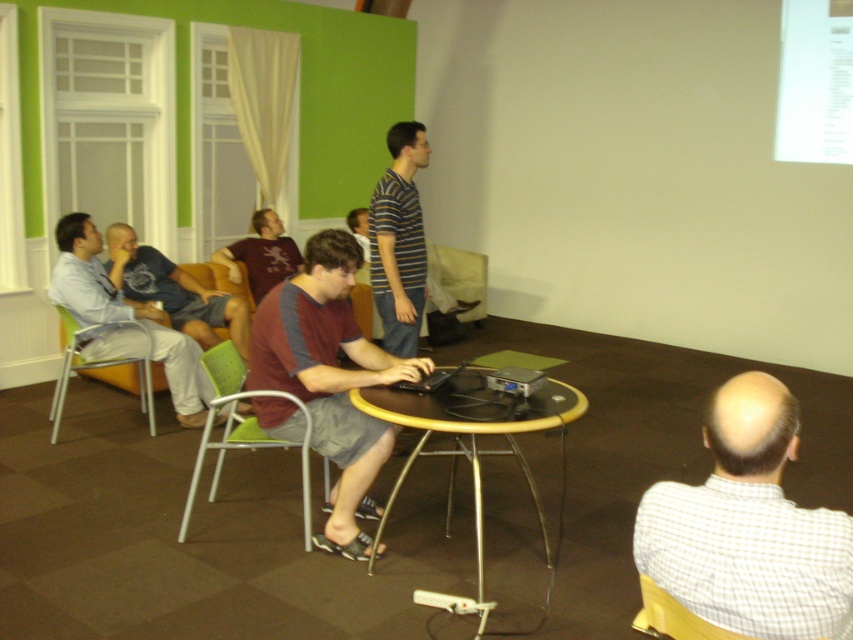
In the scene, there are two people wearing a striped cotton shirt at center and a maroon jersey at center. Which one is standing to the right of the other?

The striped cotton shirt at center is positioned on the right side of maroon jersey at center, so the striped cotton shirt at center is to the right of the maroon jersey at center.

You are standing at the entrance of the room and see the point at coordinates (100, 368). Which object is located at that point?

The point at coordinates (100, 368) is located on the green fabric chair at lower left.

You are standing at the entrance of the room and want to walk to the black plastic projector at center. There is a green fabric chair at lower left in your way. Can you walk around the chair to reach the projector?

The green fabric chair at lower left is further to the viewer than the black plastic projector at center, so the chair is closer to you. You can walk around the chair to reach the projector.